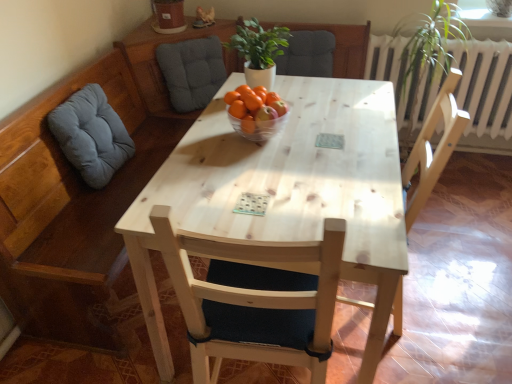
This screenshot has height=384, width=512. Identify the location of white matte plant at center. (259, 51).

You are a GUI agent. You are given a task and a screenshot of the screen. Output one action in this format:
    pyautogui.click(x=<x>, y=<y>)
    Task: Click on the gray fabric cushion at upper left, the 2th swivel chair positioned from the left
    The height and width of the screenshot is (384, 512).
    Given the screenshot: What is the action you would take?
    pyautogui.click(x=192, y=71)

What do you see at coordinates (307, 54) in the screenshot? I see `matte gray cushioned armchair at upper center` at bounding box center [307, 54].

Locate an element on the screen. This screenshot has width=512, height=384. light wood chair at center, the second chair viewed from the right is located at coordinates (254, 306).

The width and height of the screenshot is (512, 384). Describe the element at coordinates (91, 135) in the screenshot. I see `gray fabric cushion at left, the 2th swivel chair from the back` at that location.

Locate an element on the screen. The image size is (512, 384). white matte plant at center is located at coordinates (259, 51).

Can you tell me how much transparent glass bowl at center and matte gray cushioned armchair at upper center differ in facing direction?

There is a 89.7-degree angle between the facing directions of transparent glass bowl at center and matte gray cushioned armchair at upper center.

From a real-world perspective, is transparent glass bowl at center physically located above or below matte gray cushioned armchair at upper center?

transparent glass bowl at center is situated higher than matte gray cushioned armchair at upper center in the real world.

Based on the photo, is transparent glass bowl at center smaller than matte gray cushioned armchair at upper center?

Yes.

Could you tell me if transparent glass bowl at center is facing matte gray cushioned armchair at upper center?

No, transparent glass bowl at center is not oriented towards matte gray cushioned armchair at upper center.

Relative to matte gray cushioned armchair at upper center, is white matte plant at center in front or behind?

white matte plant at center is positioned closer to the viewer than matte gray cushioned armchair at upper center.

Is white matte plant at center facing away from matte gray cushioned armchair at upper center?

white matte plant at center is not turned away from matte gray cushioned armchair at upper center.

Does white matte plant at center have a larger size compared to matte gray cushioned armchair at upper center?

Actually, white matte plant at center might be smaller than matte gray cushioned armchair at upper center.

Is matte gray cushioned armchair at upper center located within white matte plant at center?

No, matte gray cushioned armchair at upper center is not inside white matte plant at center.

Can you confirm if matte gray cushioned armchair at upper center is bigger than light wood chair at center, the second chair viewed from the right?

No.

Considering the positions of objects matte gray cushioned armchair at upper center and light wood chair at center, positioned as the 1th chair in left-to-right order, in the image provided, who is more to the left, matte gray cushioned armchair at upper center or light wood chair at center, positioned as the 1th chair in left-to-right order,?

From the viewer's perspective, light wood chair at center, positioned as the 1th chair in left-to-right order, appears more on the left side.

Is matte gray cushioned armchair at upper center thinner than light wood chair at center, positioned as the 1th chair in left-to-right order?

Yes.

Does matte gray cushioned armchair at upper center turn towards light wood chair at center, positioned as the 1th chair in left-to-right order?

Yes, matte gray cushioned armchair at upper center is oriented towards light wood chair at center, positioned as the 1th chair in left-to-right order.

Is light wood chair at center, the second chair viewed from the right, further to the viewer compared to gray fabric cushion at left, the second swivel chair positioned from the right?

No, the depth of light wood chair at center, the second chair viewed from the right, is less than that of gray fabric cushion at left, the second swivel chair positioned from the right.

Where is `the 2nd chair positioned below the gray fabric cushion at left, positioned as the first swivel chair in front-to-back order (from the image's perspective)`? The height and width of the screenshot is (384, 512). the 2nd chair positioned below the gray fabric cushion at left, positioned as the first swivel chair in front-to-back order (from the image's perspective) is located at coordinates (254, 306).

Can you confirm if light wood chair at center, the second chair viewed from the right, is taller than gray fabric cushion at left, positioned as the first swivel chair in front-to-back order?

Yes, light wood chair at center, the second chair viewed from the right, is taller than gray fabric cushion at left, positioned as the first swivel chair in front-to-back order.

From a real-world perspective, is light wood chair at center, the second chair viewed from the right, beneath gray fabric cushion at left, positioned as the first swivel chair in front-to-back order?

Yes.

Can you confirm if matte gray cushioned armchair at upper center is taller than light wood chair at right, the 2th chair positioned from the left?

No.

Is matte gray cushioned armchair at upper center not near light wood chair at right, the 2th chair positioned from the left?

matte gray cushioned armchair at upper center is near light wood chair at right, the 2th chair positioned from the left, not far away.

Considering the relative sizes of matte gray cushioned armchair at upper center and light wood chair at right, the 2th chair positioned from the left, in the image provided, is matte gray cushioned armchair at upper center bigger than light wood chair at right, the 2th chair positioned from the left,?

Actually, matte gray cushioned armchair at upper center might be smaller than light wood chair at right, the 2th chair positioned from the left.

Is point (257, 71) farther from camera compared to point (175, 88)?

That is False.

Is white matte plant at center behind gray fabric cushion at upper left, which ranks as the first swivel chair in right-to-left order?

No, white matte plant at center is closer to the viewer.

How different are the orientations of white matte plant at center and gray fabric cushion at upper left, which ranks as the first swivel chair in right-to-left order, in degrees?

The angular difference between white matte plant at center and gray fabric cushion at upper left, which ranks as the first swivel chair in right-to-left order, is 45.6 degrees.

Between white matte plant at center and gray fabric cushion at upper left, positioned as the 1th swivel chair in back-to-front order, which one has larger width?

white matte plant at center.

Are gray fabric cushion at left, which is the 1th swivel chair in left-to-right order, and light wood chair at right, the 2th chair positioned from the left, beside each other?

They are not placed beside each other.

Can you confirm if gray fabric cushion at left, positioned as the first swivel chair in front-to-back order, is smaller than light wood chair at right, acting as the first chair starting from the right?

Yes, gray fabric cushion at left, positioned as the first swivel chair in front-to-back order, is smaller than light wood chair at right, acting as the first chair starting from the right.

In the image, is gray fabric cushion at left, the 2th swivel chair from the back, on the left side or the right side of light wood chair at right, the 2th chair positioned from the left?

In the image, gray fabric cushion at left, the 2th swivel chair from the back, appears on the left side of light wood chair at right, the 2th chair positioned from the left.

At what (x,y) coordinates should I click in order to perform the action: click on glass bowl located on the left of matte gray cushioned armchair at upper center. Please return your answer as a coordinate pair (x, y). The height and width of the screenshot is (384, 512). Looking at the image, I should click on (257, 127).

Find the location of a particular element. houseplant below the matte gray cushioned armchair at upper center (from the image's perspective) is located at coordinates (259, 51).

Looking at the image, which one is located closer to gray fabric cushion at left, which is the 1th swivel chair in left-to-right order, transparent glass bowl at center or gray fabric cushion at upper left, the 2th swivel chair positioned from the left?

The object closer to gray fabric cushion at left, which is the 1th swivel chair in left-to-right order, is transparent glass bowl at center.

Considering their positions, is light wood chair at right, the 2th chair positioned from the left, positioned further to light wood chair at center, the second chair viewed from the right, than gray fabric cushion at upper left, positioned as the 1th swivel chair in back-to-front order?

gray fabric cushion at upper left, positioned as the 1th swivel chair in back-to-front order, is further to light wood chair at center, the second chair viewed from the right.

Based on their spatial positions, is matte gray cushioned armchair at upper center or white matte plant at center closer to light wood chair at right, the 2th chair positioned from the left?

Based on the image, white matte plant at center appears to be nearer to light wood chair at right, the 2th chair positioned from the left.

Based on their spatial positions, is matte gray cushioned armchair at upper center or gray fabric cushion at upper left, positioned as the 1th swivel chair in back-to-front order, closer to light wood chair at right, acting as the first chair starting from the right?

gray fabric cushion at upper left, positioned as the 1th swivel chair in back-to-front order, lies closer to light wood chair at right, acting as the first chair starting from the right, than the other object.

In the scene shown: From the image, which object appears to be farther from light wood chair at right, acting as the first chair starting from the right, transparent glass bowl at center or gray fabric cushion at left, which is the 1th swivel chair in left-to-right order?

Among the two, gray fabric cushion at left, which is the 1th swivel chair in left-to-right order, is located further to light wood chair at right, acting as the first chair starting from the right.

Consider the image. From the image, which object appears to be nearer to white matte plant at center, gray fabric cushion at upper left, the 2th swivel chair positioned from the left, or light wood chair at right, the 2th chair positioned from the left?

Based on the image, light wood chair at right, the 2th chair positioned from the left, appears to be nearer to white matte plant at center.

Based on their spatial positions, is gray fabric cushion at left, the second swivel chair positioned from the right, or light wood chair at right, acting as the first chair starting from the right, further from light wood chair at center, the second chair viewed from the right?

Among the two, gray fabric cushion at left, the second swivel chair positioned from the right, is located further to light wood chair at center, the second chair viewed from the right.

Looking at the image, which one is located further to light wood chair at center, the second chair viewed from the right, gray fabric cushion at upper left, the 2th swivel chair positioned from the left, or light wood chair at right, the 2th chair positioned from the left?

gray fabric cushion at upper left, the 2th swivel chair positioned from the left.

The image size is (512, 384). I want to click on houseplant between light wood chair at center, the second chair viewed from the right, and matte gray cushioned armchair at upper center, along the z-axis, so click(259, 51).

The image size is (512, 384). Find the location of `glass bowl situated between gray fabric cushion at left, the 2th swivel chair from the back, and light wood chair at right, the 2th chair positioned from the left, from left to right`. glass bowl situated between gray fabric cushion at left, the 2th swivel chair from the back, and light wood chair at right, the 2th chair positioned from the left, from left to right is located at coordinates (257, 127).

I want to click on glass bowl between white matte plant at center and light wood chair at center, positioned as the 1th chair in left-to-right order, in the vertical direction, so click(x=257, y=127).

I want to click on swivel chair located between gray fabric cushion at left, which is the 1th swivel chair in left-to-right order, and matte gray cushioned armchair at upper center in the left-right direction, so click(192, 71).